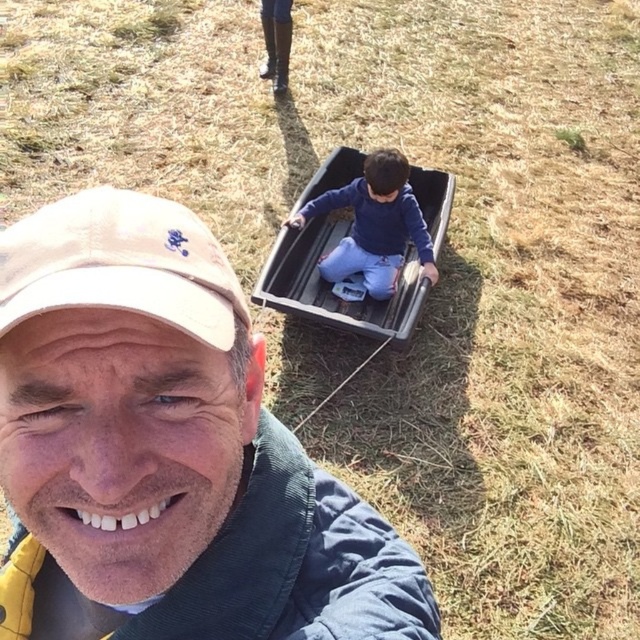
Does matte khaki cap at upper left appear on the left side of beige fabric cap at upper left?

Yes, matte khaki cap at upper left is to the left of beige fabric cap at upper left.

Is matte khaki cap at upper left to the right of beige fabric cap at upper left from the viewer's perspective?

No, matte khaki cap at upper left is not to the right of beige fabric cap at upper left.

Is point (243, 452) positioned before point (60, 240)?

No, (243, 452) is behind (60, 240).

Locate an element on the screen. Image resolution: width=640 pixels, height=640 pixels. matte khaki cap at upper left is located at coordinates (166, 451).

Is matte khaki cap at upper left shorter than black plastic wagon at center?

Indeed, matte khaki cap at upper left has a lesser height compared to black plastic wagon at center.

Find the location of a particular element. The width and height of the screenshot is (640, 640). matte khaki cap at upper left is located at coordinates (166, 451).

Does beige fabric cap at upper left appear on the left side of black plastic wagon at center?

Correct, you'll find beige fabric cap at upper left to the left of black plastic wagon at center.

Does beige fabric cap at upper left have a greater width compared to black plastic wagon at center?

In fact, beige fabric cap at upper left might be narrower than black plastic wagon at center.

Is point (84, 211) positioned in front of point (273, 294)?

That is True.

Find the location of a particular element. beige fabric cap at upper left is located at coordinates (120, 264).